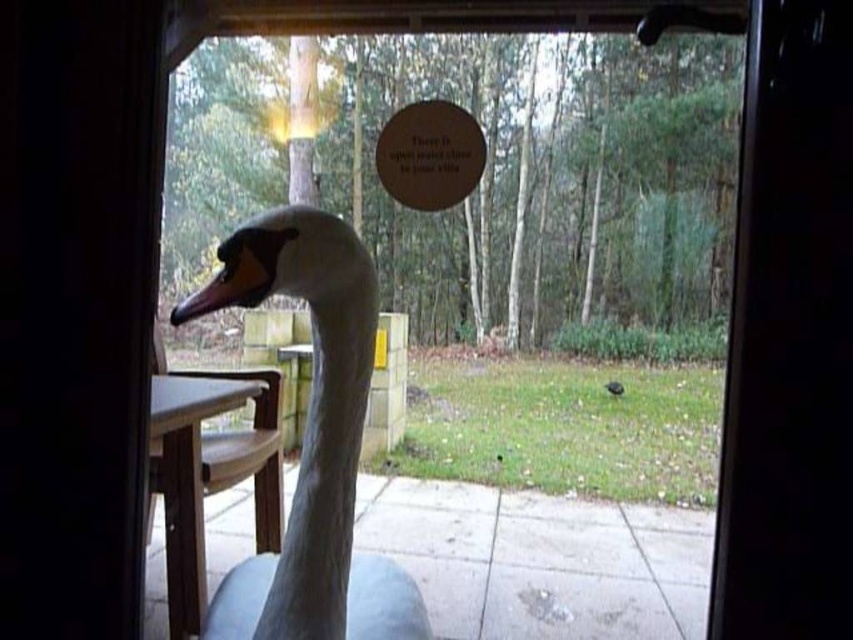
The image size is (853, 640). Find the location of `white matte swan at center`. white matte swan at center is located at coordinates (317, 449).

Is transparent glass screen door at center bigger than white matte swan at center?

No, transparent glass screen door at center is not bigger than white matte swan at center.

Who is positioned more to the left, transparent glass screen door at center or white matte swan at center?

white matte swan at center is more to the left.

Which is in front, point (764, 403) or point (346, 257)?

Positioned in front is point (346, 257).

Identify the location of transparent glass screen door at center. The width and height of the screenshot is (853, 640). (788, 337).

Does transparent glass screen door at center appear on the left side of matte orange beak at center?

No, transparent glass screen door at center is not to the left of matte orange beak at center.

Can you confirm if transparent glass screen door at center is taller than matte orange beak at center?

Yes, transparent glass screen door at center is taller than matte orange beak at center.

What are the coordinates of `transparent glass screen door at center` in the screenshot? It's located at (788, 337).

Find the location of a particular element. The height and width of the screenshot is (640, 853). transparent glass screen door at center is located at coordinates (788, 337).